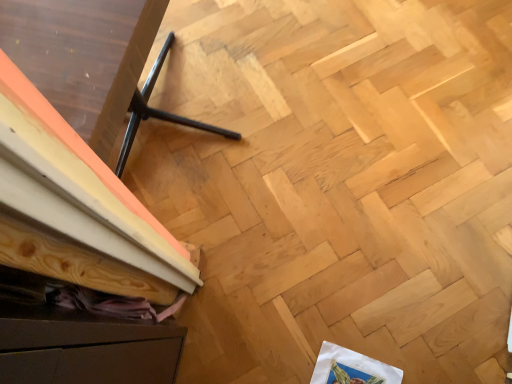
Question: From the image's perspective, relative to brown matte drawer at lower left, is white paper at lower right above or below?

Choices:
 (A) above
 (B) below

Answer: (B)

Question: In terms of width, does white paper at lower right look wider or thinner when compared to brown matte drawer at lower left?

Choices:
 (A) thin
 (B) wide

Answer: (A)

Question: Which is nearer to the white paper at lower right?

Choices:
 (A) brown matte drawer at lower left
 (B) black metal tripod at lower left

Answer: (A)

Question: Which object is positioned farthest from the brown matte drawer at lower left?

Choices:
 (A) black metal tripod at lower left
 (B) white paper at lower right

Answer: (B)